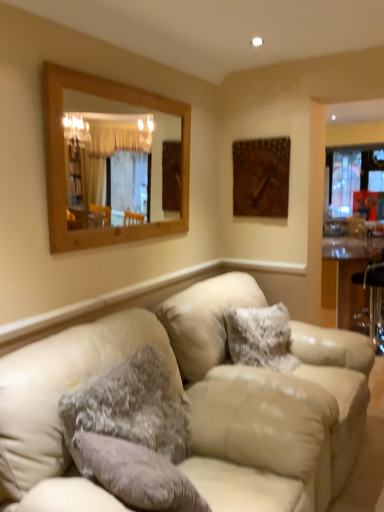
Question: Is wooden frame mirror at upper left in front of brown wooden picture frame at upper right?

Choices:
 (A) no
 (B) yes

Answer: (B)

Question: From a real-world perspective, is wooden frame mirror at upper left physically below brown wooden picture frame at upper right?

Choices:
 (A) no
 (B) yes

Answer: (A)

Question: Is wooden frame mirror at upper left to the right of brown wooden picture frame at upper right from the viewer's perspective?

Choices:
 (A) yes
 (B) no

Answer: (B)

Question: Can you confirm if wooden frame mirror at upper left is smaller than brown wooden picture frame at upper right?

Choices:
 (A) yes
 (B) no

Answer: (B)

Question: Does wooden frame mirror at upper left have a lesser height compared to brown wooden picture frame at upper right?

Choices:
 (A) no
 (B) yes

Answer: (A)

Question: From a real-world perspective, relative to brown wooden picture frame at upper right, is fuzzy fabric pillow at center, the 2th pillow viewed from the front, vertically above or below?

Choices:
 (A) below
 (B) above

Answer: (A)

Question: Looking at their shapes, would you say fuzzy fabric pillow at center, which is the 1th pillow from back to front, is wider or thinner than brown wooden picture frame at upper right?

Choices:
 (A) thin
 (B) wide

Answer: (B)

Question: From the image's perspective, relative to brown wooden picture frame at upper right, is fuzzy fabric pillow at center, the 2th pillow viewed from the front, above or below?

Choices:
 (A) below
 (B) above

Answer: (A)

Question: Considering their positions, is fuzzy fabric pillow at center, which is the 1th pillow from right to left, located in front of or behind brown wooden picture frame at upper right?

Choices:
 (A) behind
 (B) front

Answer: (B)

Question: In the image, is fuzzy fabric pillow at center, which is the 1th pillow from back to front, positioned in front of or behind beige leather couch at center?

Choices:
 (A) behind
 (B) front

Answer: (A)

Question: Choose the correct answer: Is fuzzy fabric pillow at center, which is the 1th pillow from back to front, inside beige leather couch at center or outside it?

Choices:
 (A) outside
 (B) inside

Answer: (A)

Question: Considering the positions of fuzzy fabric pillow at center, which is the 1th pillow from back to front, and beige leather couch at center in the image, is fuzzy fabric pillow at center, which is the 1th pillow from back to front, bigger or smaller than beige leather couch at center?

Choices:
 (A) small
 (B) big

Answer: (A)

Question: Considering the positions of point (274, 352) and point (372, 357), is point (274, 352) closer or farther from the camera than point (372, 357)?

Choices:
 (A) farther
 (B) closer

Answer: (A)

Question: Is point (374, 163) closer or farther from the camera than point (158, 113)?

Choices:
 (A) closer
 (B) farther

Answer: (B)

Question: Is clear glass window at right inside or outside of wooden frame mirror at upper left?

Choices:
 (A) inside
 (B) outside

Answer: (B)